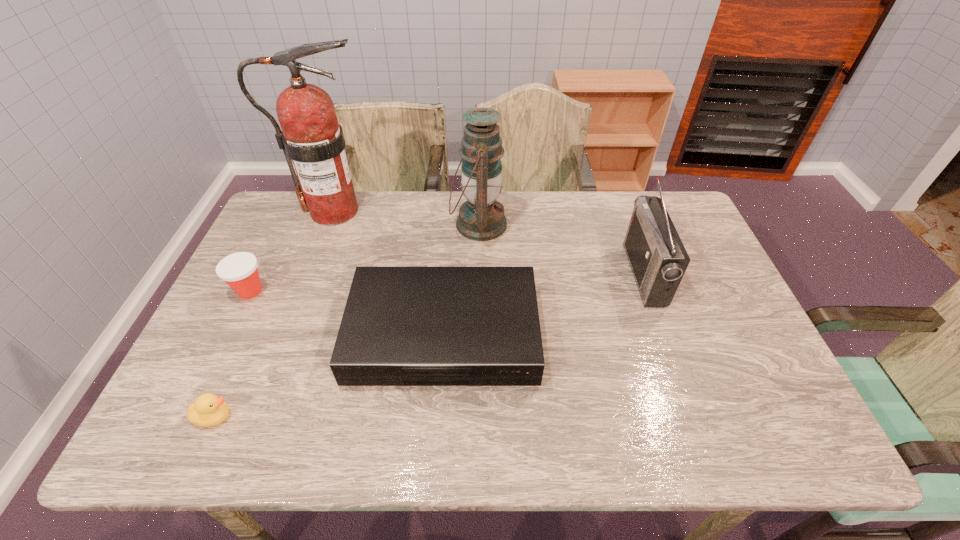
Locate an element on the screen. The image size is (960, 540). vacant space in between the shortest object and the Dixie cup is located at coordinates (232, 354).

What are the coordinates of `free space between the fifth shortest object and the radio receiver` in the screenshot? It's located at (562, 249).

Identify the location of empty space that is in between the radio receiver and the fire extinguisher. (489, 242).

At what (x,y) coordinates should I click in order to perform the action: click on free space between the second tallest object and the fire extinguisher. Please return your answer as a coordinate pair (x, y). This screenshot has height=540, width=960. Looking at the image, I should click on (406, 218).

This screenshot has width=960, height=540. I want to click on object that is the fifth closest one to the CD player, so click(658, 259).

Locate which object ranks fifth in proximity to the fourth shortest object. Please provide its 2D coordinates. Your answer should be formatted as a tuple, i.e. [(x, y)], where the tuple contains the x and y coordinates of a point satisfying the conditions above.

[(239, 270)]

Image resolution: width=960 pixels, height=540 pixels. I want to click on vacant space that satisfies the following two spatial constraints: 1. at the nozzle of the fire extinguisher; 2. on the left side of the oil lamp, so click(x=328, y=225).

Image resolution: width=960 pixels, height=540 pixels. I want to click on vacant region that satisfies the following two spatial constraints: 1. at the front of the CD player for disc insertion; 2. on the face of the shortest object, so click(438, 416).

Locate an element on the screen. free space in the image that satisfies the following two spatial constraints: 1. at the front of the CD player for disc insertion; 2. on the face of the duckling is located at coordinates (438, 416).